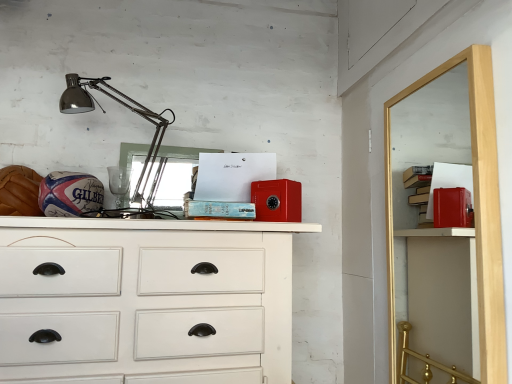
Question: Can you confirm if red matte safe at upper right is shorter than white painted wood chest of drawers at center?

Choices:
 (A) no
 (B) yes

Answer: (A)

Question: Is red matte safe at upper right not near white painted wood chest of drawers at center?

Choices:
 (A) yes
 (B) no

Answer: (B)

Question: Can you confirm if red matte safe at upper right is bigger than white painted wood chest of drawers at center?

Choices:
 (A) yes
 (B) no

Answer: (B)

Question: Is red matte safe at upper right smaller than white painted wood chest of drawers at center?

Choices:
 (A) no
 (B) yes

Answer: (B)

Question: Is red matte safe at upper right not inside white painted wood chest of drawers at center?

Choices:
 (A) yes
 (B) no

Answer: (A)

Question: Can you confirm if red matte safe at upper right is wider than white painted wood chest of drawers at center?

Choices:
 (A) yes
 (B) no

Answer: (B)

Question: Is red matte safe at upper right further to the viewer compared to metallic silver lamp at upper left?

Choices:
 (A) no
 (B) yes

Answer: (A)

Question: Is metallic silver lamp at upper left located within red matte safe at upper right?

Choices:
 (A) yes
 (B) no

Answer: (B)

Question: Considering the relative sizes of red matte safe at upper right and metallic silver lamp at upper left in the image provided, is red matte safe at upper right smaller than metallic silver lamp at upper left?

Choices:
 (A) no
 (B) yes

Answer: (B)

Question: Is red matte safe at upper right taller than metallic silver lamp at upper left?

Choices:
 (A) no
 (B) yes

Answer: (B)

Question: Is the depth of red matte safe at upper right less than that of metallic silver lamp at upper left?

Choices:
 (A) yes
 (B) no

Answer: (A)

Question: Can you confirm if red matte safe at upper right is positioned to the left of metallic silver lamp at upper left?

Choices:
 (A) yes
 (B) no

Answer: (B)

Question: Is white painted wood chest of drawers at center facing away from metallic silver lamp at upper left?

Choices:
 (A) yes
 (B) no

Answer: (B)